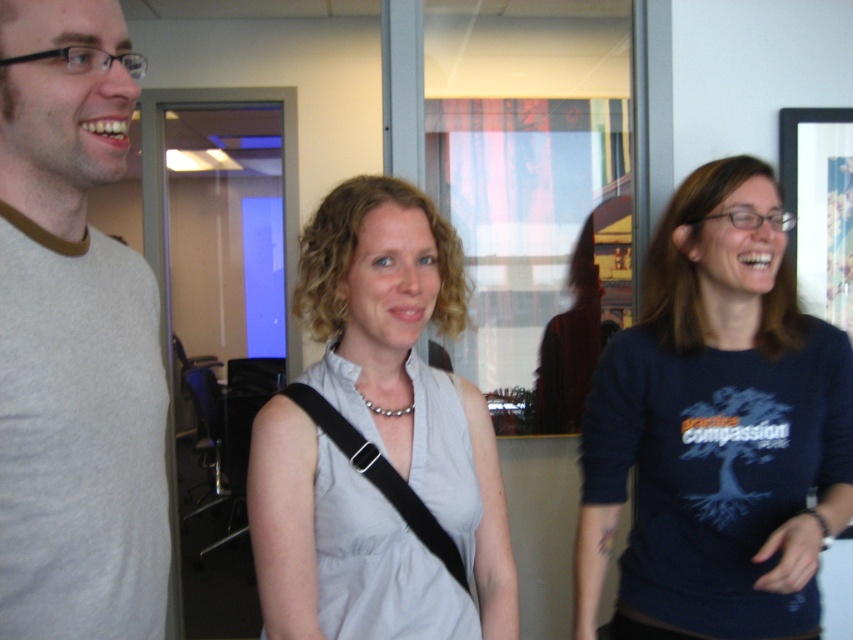
What are the coordinates of the dark blue cotton shirt at center?

The dark blue cotton shirt at center is located at coordinates point (717, 428).

You are a photographer setting up for a group photo in an office. You notice two clothing items in the scene, the dark blue cotton shirt at center and the light gray fabric dress at center. Which clothing item is positioned to the left of the other?

The dark blue cotton shirt at center is to the right of the light gray fabric dress at center, so the light gray fabric dress at center is positioned to the left of the dark blue cotton shirt at center.